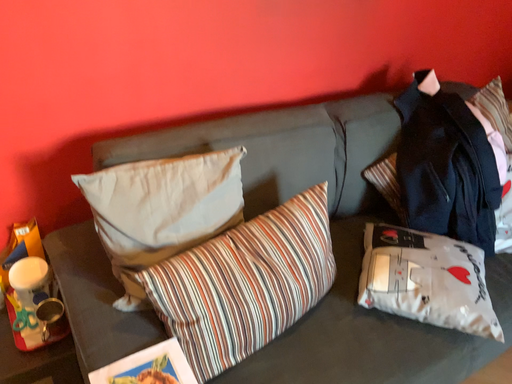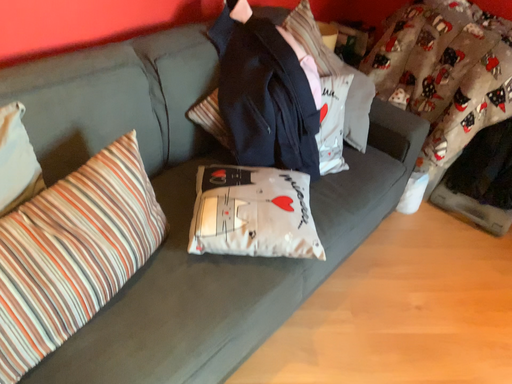
Question: Which way did the camera rotate in the video?

Choices:
 (A) rotated downward
 (B) rotated upward

Answer: (A)